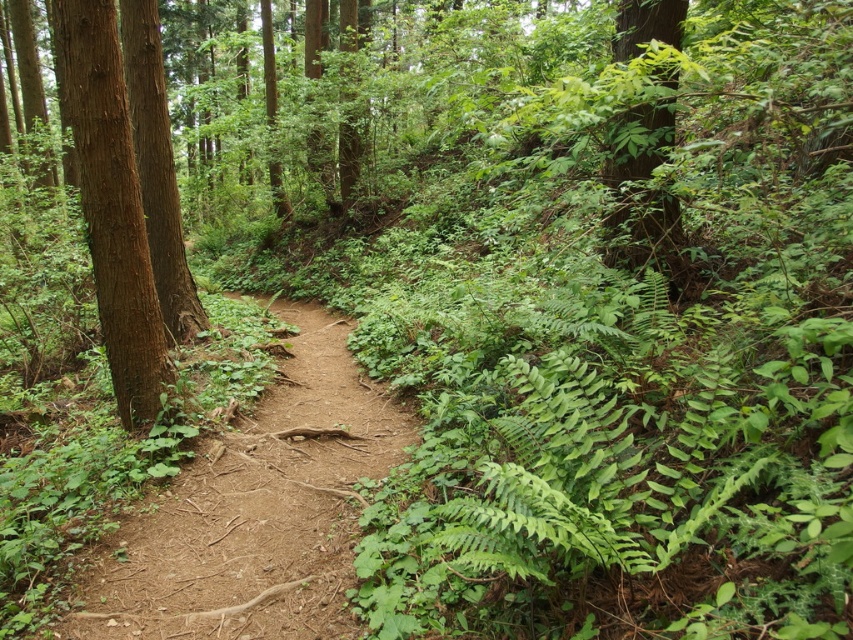
Is dirt path at center thinner than brown rough bark tree at left?

In fact, dirt path at center might be wider than brown rough bark tree at left.

Find the location of `dirt path at center`. dirt path at center is located at coordinates (254, 509).

Is brown rough bark tree at left smaller than brown rough tree at left?

Yes, brown rough bark tree at left is smaller than brown rough tree at left.

Is the position of brown rough bark tree at left more distant than that of brown rough tree at left?

No, it is not.

Is point (80, 116) less distant than point (137, 77)?

That is True.

Where is `brown rough bark tree at left`? The image size is (853, 640). brown rough bark tree at left is located at coordinates (111, 204).

Is dirt path at center thinner than green leafy tree at upper right?

Incorrect, dirt path at center's width is not less than green leafy tree at upper right's.

Between dirt path at center and green leafy tree at upper right, which one has more height?

green leafy tree at upper right is taller.

Where is `dirt path at center`? dirt path at center is located at coordinates (254, 509).